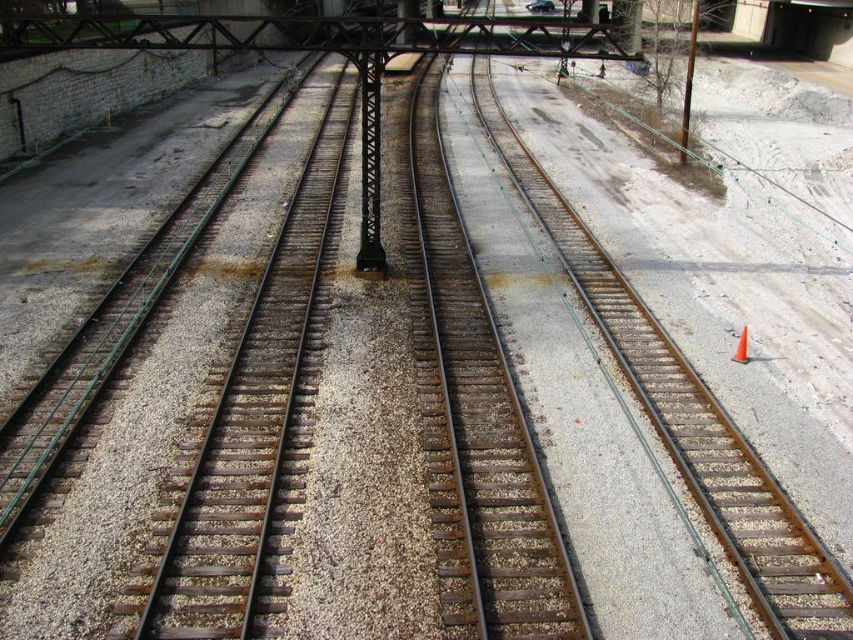
Question: Where is rusty metal bridge at upper center located in relation to orange plastic traffic cone at center-right in the image?

Choices:
 (A) above
 (B) below

Answer: (A)

Question: Is rusty metal bridge at upper center smaller than orange plastic traffic cone at center-right?

Choices:
 (A) no
 (B) yes

Answer: (A)

Question: Is rusty metal bridge at upper center wider than orange plastic traffic cone at center-right?

Choices:
 (A) yes
 (B) no

Answer: (A)

Question: Which object appears farthest from the camera in this image?

Choices:
 (A) rusty metal bridge at upper center
 (B) orange plastic traffic cone at center-right

Answer: (A)